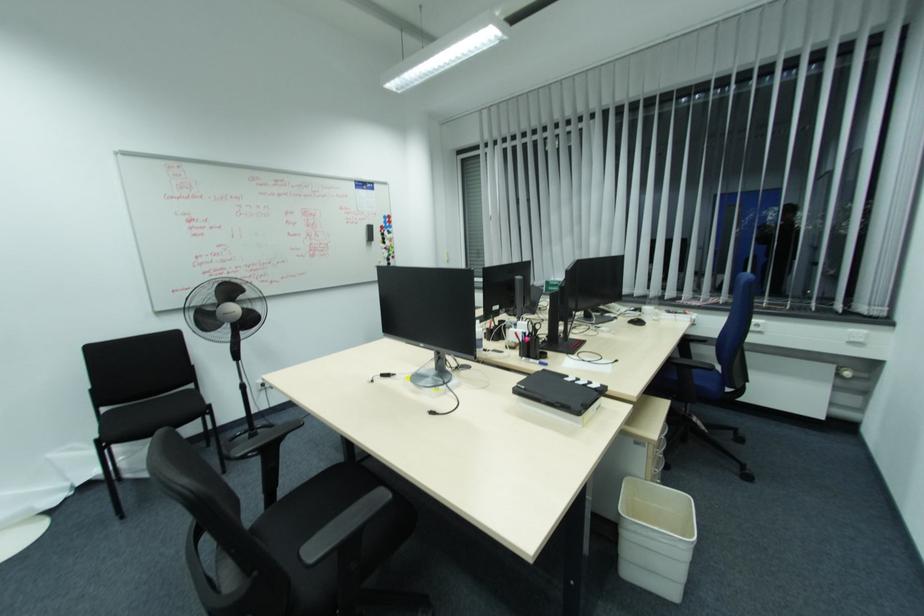
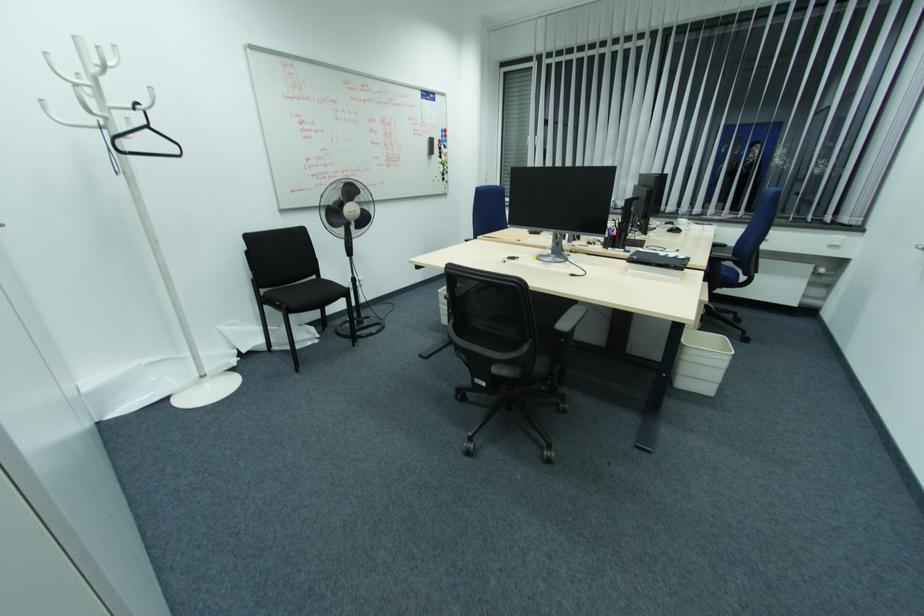
Locate, in the second image, the point that corresponds to point (638, 323) in the first image.

(676, 231)